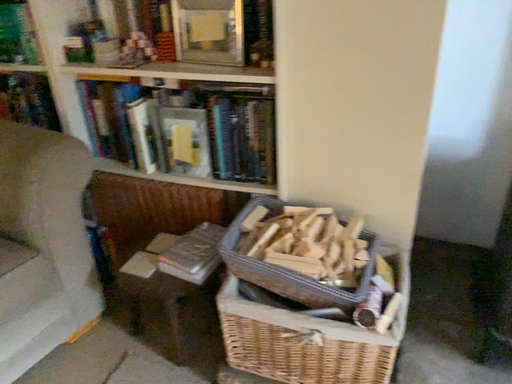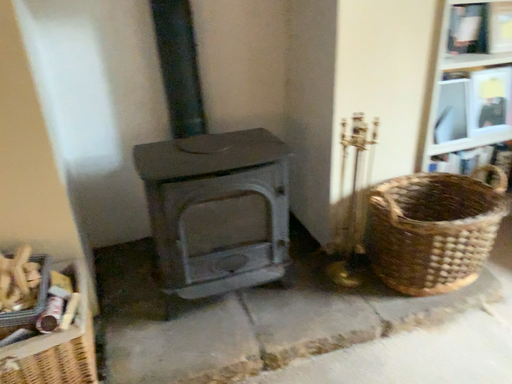
Question: How did the camera likely rotate when shooting the video?

Choices:
 (A) rotated upward
 (B) rotated downward

Answer: (A)